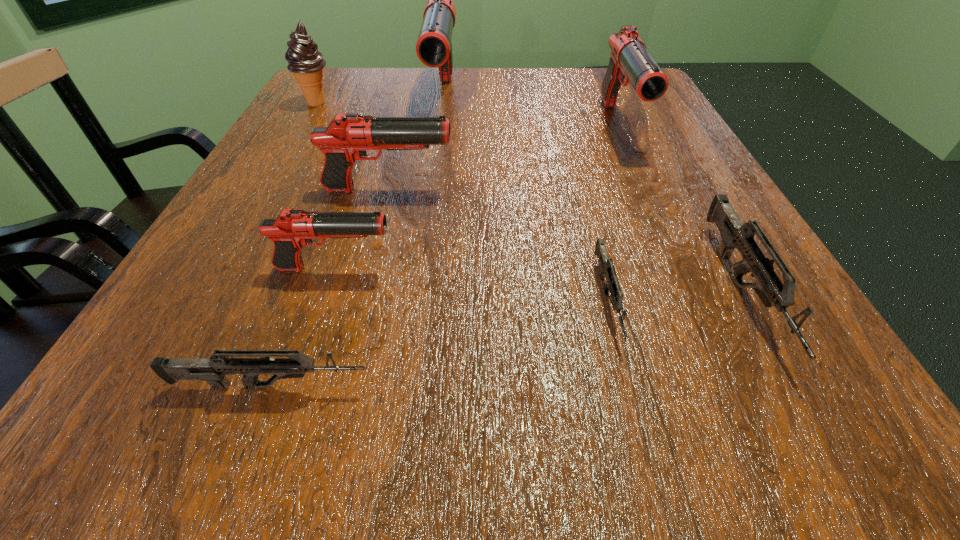
Image resolution: width=960 pixels, height=540 pixels. I want to click on free location at the left edge, so click(x=320, y=151).

In the image, there is a desktop. Where is `free space at the right edge`? The image size is (960, 540). free space at the right edge is located at coordinates (700, 208).

I want to click on vacant area at the far left corner, so click(385, 69).

Locate an element on the screen. This screenshot has width=960, height=540. vacant area at the near left corner is located at coordinates (162, 394).

At what (x,y) coordinates should I click in order to perform the action: click on free location at the near right corner of the desktop. Please return your answer as a coordinate pair (x, y). The height and width of the screenshot is (540, 960). Looking at the image, I should click on (726, 412).

Find the location of a particular element. This screenshot has width=960, height=540. free space between the second gun from right to left and the leftmost grey gun is located at coordinates click(x=444, y=255).

Where is `free spot between the biggest black gun and the rightmost grey gun`? The width and height of the screenshot is (960, 540). free spot between the biggest black gun and the rightmost grey gun is located at coordinates (592, 195).

Find the location of a particular element. free area in between the sixth object from left to right and the second object from right to left is located at coordinates (612, 213).

The image size is (960, 540). In order to click on vacant area between the fifth shortest object and the sixth tallest gun in this screenshot , I will do `click(330, 288)`.

Identify the location of empty space that is in between the smallest grey gun and the icecream. This screenshot has height=540, width=960. pos(463,201).